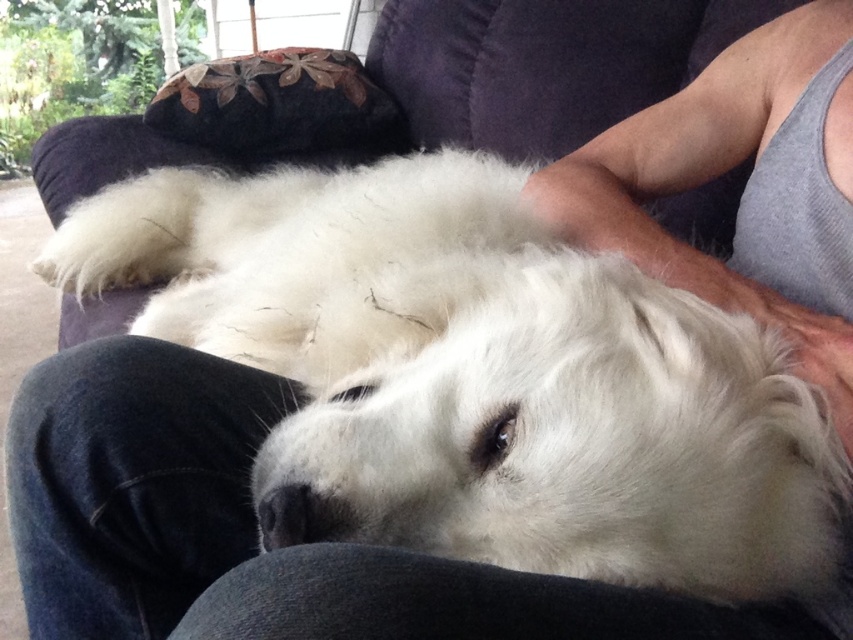
You are a dog groomer assessing the space needed to groom the white fluffy dog at center and the gray tank top at upper right. Which object requires more horizontal space?

The white fluffy dog at center requires more horizontal space because its width is larger than the gray tank top at upper right.

You are a photographer trying to capture the white fluffy dog at center and the gray tank top at upper right in the same frame. Based on their positions, which object is closer to the left side of the image?

The white fluffy dog at center is to the left of the gray tank top at upper right, so it is closer to the left side of the image.

You are a photographer taking a picture of the scene. You want to focus on the white fluffy dog at center and the gray tank top at upper right. Which object should you adjust your camera focus on first if you want to ensure the closest object is sharp?

The white fluffy dog at center is closer to the viewer than the gray tank top at upper right, so you should focus on the white fluffy dog at center first to ensure it is sharp.